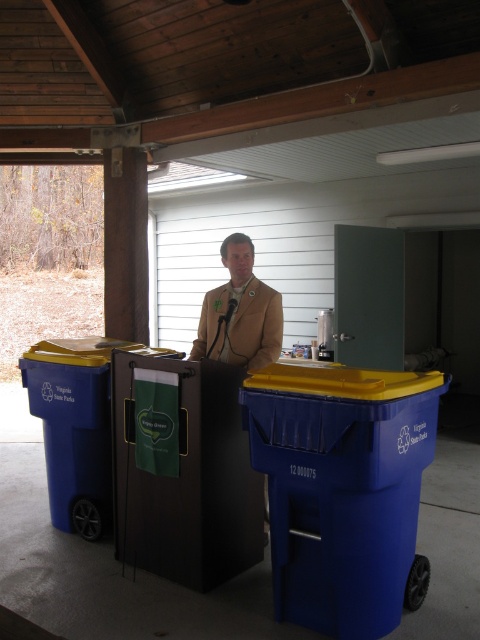
Is point (87, 413) positioned before point (278, 330)?

No, (87, 413) is behind (278, 330).

The width and height of the screenshot is (480, 640). What do you see at coordinates (74, 426) in the screenshot?
I see `blue plastic recycling bin at left` at bounding box center [74, 426].

The image size is (480, 640). What do you see at coordinates (74, 426) in the screenshot?
I see `blue plastic recycling bin at left` at bounding box center [74, 426].

The width and height of the screenshot is (480, 640). What are the coordinates of `blue plastic recycling bin at left` in the screenshot? It's located at (74, 426).

Who is lower down, blue plastic recycling bin at center or tan fabric jacket at center?

blue plastic recycling bin at center

Is blue plastic recycling bin at center taller than tan fabric jacket at center?

Yes, blue plastic recycling bin at center is taller than tan fabric jacket at center.

Is point (432, 404) farther from camera compared to point (212, 305)?

No, (432, 404) is in front of (212, 305).

Image resolution: width=480 pixels, height=640 pixels. What are the coordinates of `blue plastic recycling bin at center` in the screenshot? It's located at (343, 490).

Can you confirm if blue plastic cooler at center is bigger than blue plastic recycling bin at left?

No.

Is blue plastic cooler at center further to camera compared to blue plastic recycling bin at left?

No, it is not.

What do you see at coordinates (183, 470) in the screenshot?
I see `blue plastic cooler at center` at bounding box center [183, 470].

The image size is (480, 640). Identify the location of blue plastic cooler at center. (183, 470).